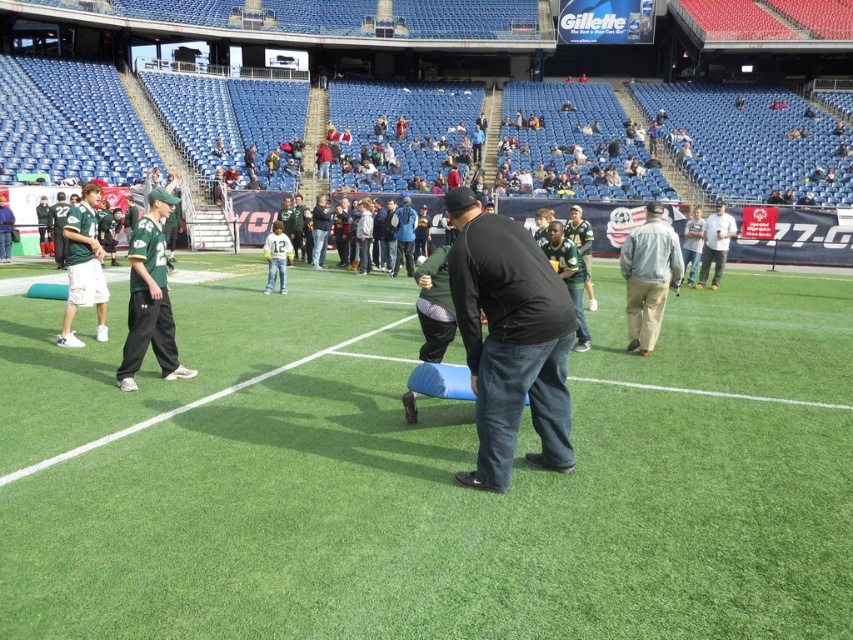
You are a photographer standing at the edge of the field. You want to capture a closeup shot of the green jersey at left. The camera you are using has a minimum focusing distance of 5 meters. Will you be able to take the photo without moving closer?

The green jersey at left is 7.07 meters away from the camera. Since the minimum focusing distance is 5 meters, the photographer can take the photo without moving closer because the distance is within the camera capabilities.

Based on the photo, you are a photographer at the stadium and need to capture a group photo of the white cotton shirt at center and the green jersey at center. Since you want to ensure both are visible clearly, which one should you focus on first considering their sizes?

The white cotton shirt at center has a larger width than the green jersey at center, so you should focus on the white cotton shirt at center first to ensure it is in clear view before adjusting for the smaller green jersey at center.